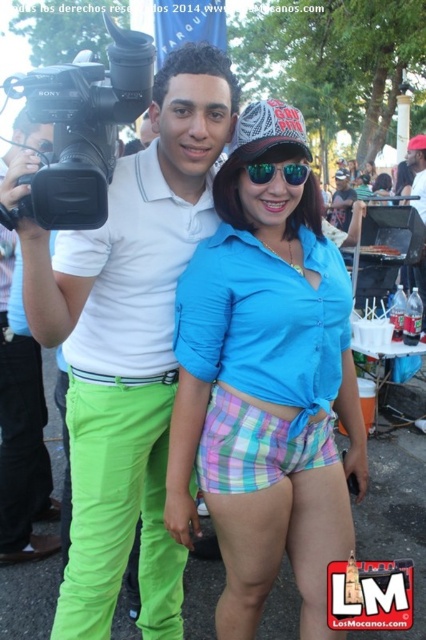
Question: Where is blue cotton shirt at center located in relation to matte white shirt at center in the image?

Choices:
 (A) below
 (B) above

Answer: (A)

Question: Which point is farther from the camera taking this photo?

Choices:
 (A) (241, 580)
 (B) (14, 86)

Answer: (A)

Question: Among these objects, which one is farthest from the camera?

Choices:
 (A) matte white polo shirt at center
 (B) black plastic video camera at upper left

Answer: (A)

Question: Is matte white polo shirt at center thinner than black plastic video camera at upper left?

Choices:
 (A) yes
 (B) no

Answer: (B)

Question: Does matte white polo shirt at center come in front of green reflective sunglasses at center?

Choices:
 (A) no
 (B) yes

Answer: (B)

Question: Among these objects, which one is nearest to the camera?

Choices:
 (A) blue cotton shirt at center
 (B) green reflective sunglasses at center
 (C) matte white polo shirt at center

Answer: (C)